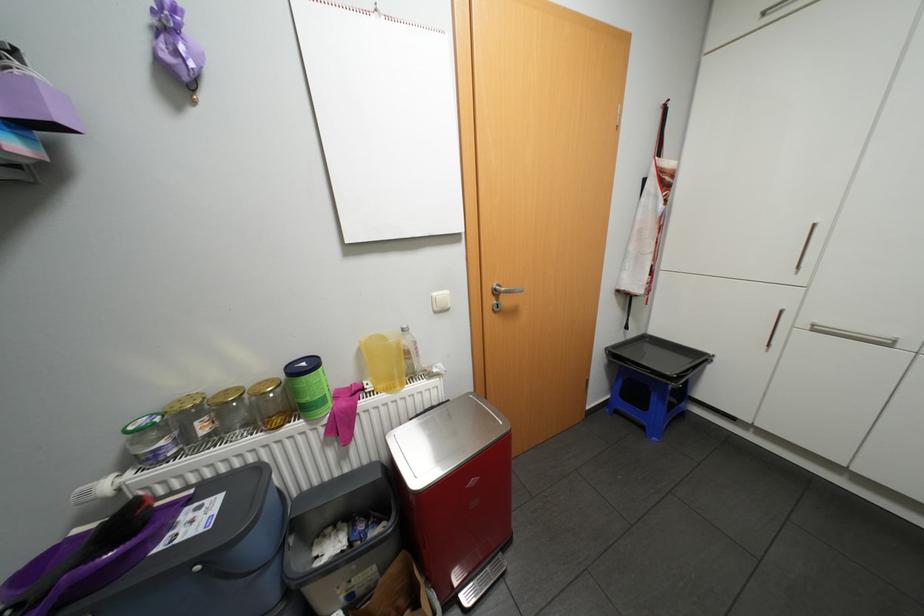
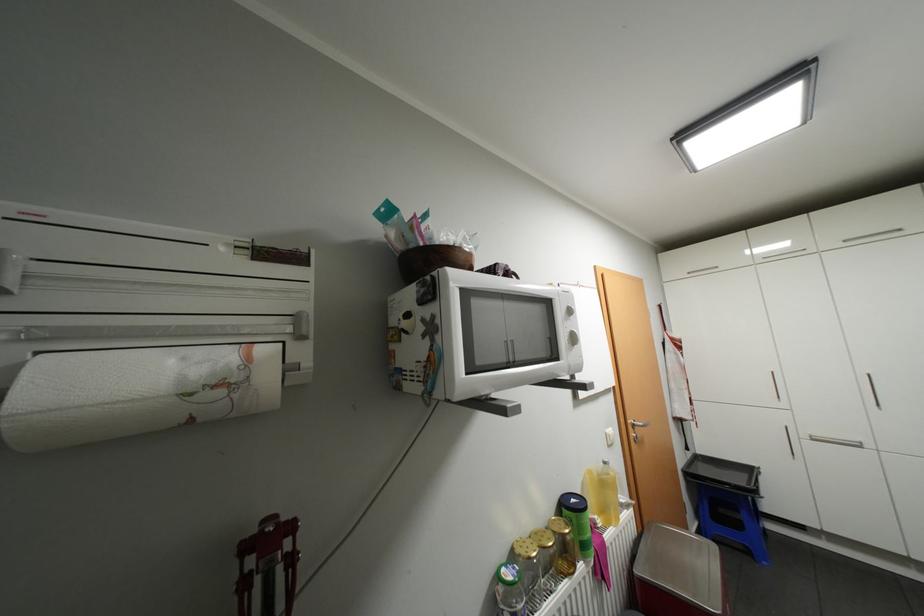
The point at [377,386] is marked in the first image. Where is the corresponding point in the second image?

(606, 521)